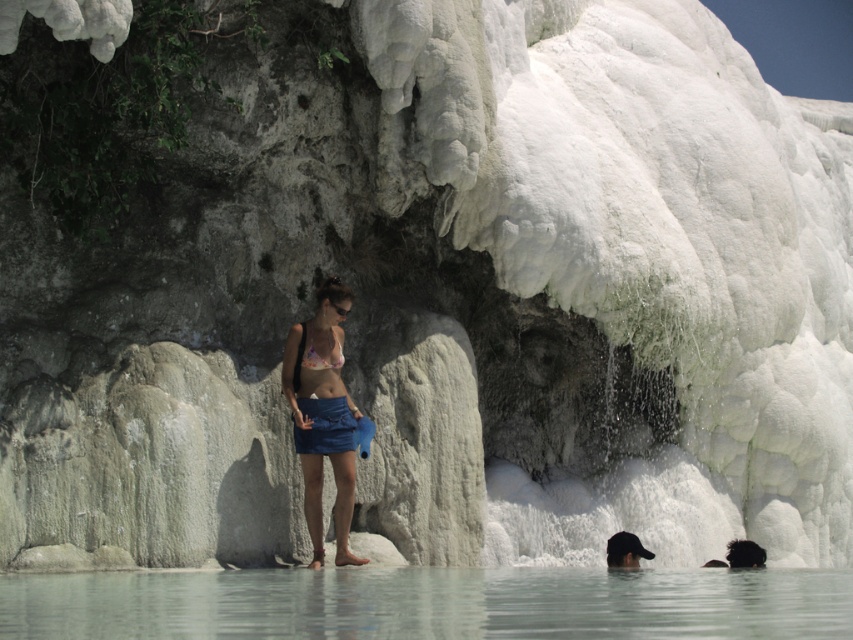
Question: Is black matte cap at lower center below matte white bikini top at center?

Choices:
 (A) no
 (B) yes

Answer: (B)

Question: Does black matte cap at lower center appear on the left side of matte white bikini top at center?

Choices:
 (A) yes
 (B) no

Answer: (B)

Question: Which of the following is the closest to the observer?

Choices:
 (A) black matte cap at lower center
 (B) clear water at lower center

Answer: (B)

Question: Is clear water at lower center smaller than blue fabric skirt at center?

Choices:
 (A) no
 (B) yes

Answer: (A)

Question: Which point appears farthest from the camera in this image?

Choices:
 (A) pyautogui.click(x=749, y=609)
 (B) pyautogui.click(x=309, y=355)
 (C) pyautogui.click(x=625, y=544)

Answer: (C)

Question: Estimate the real-world distances between objects in this image. Which object is closer to the blue fabric skirt at center?

Choices:
 (A) clear water at lower center
 (B) black matte cap at lower center
 (C) matte white bikini top at center

Answer: (C)